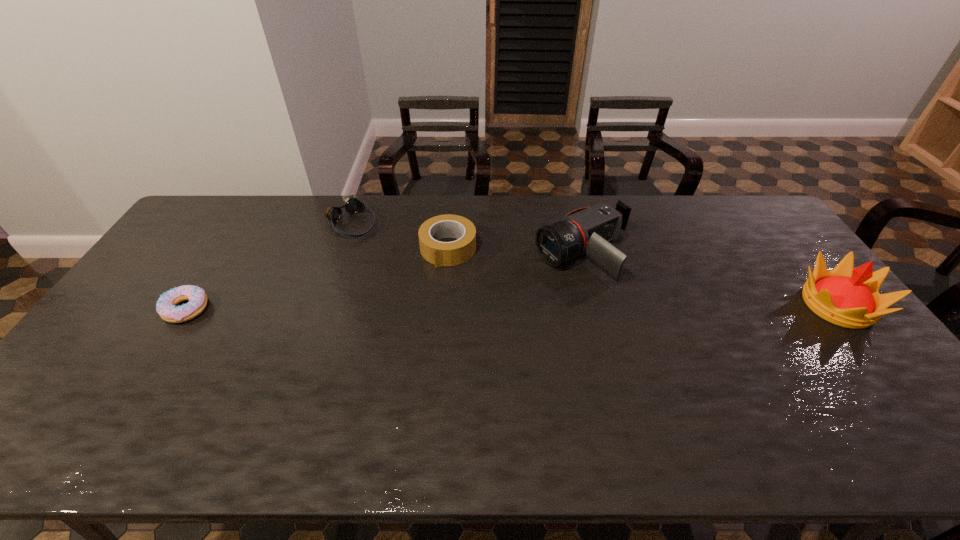
This screenshot has height=540, width=960. I want to click on free space between the crown and the duct tape, so click(x=642, y=277).

The height and width of the screenshot is (540, 960). What are the coordinates of `vacant area between the crown and the fourth object from left to right` in the screenshot? It's located at (710, 279).

Find the location of a particular element. vacant area between the crown and the shortest object is located at coordinates (512, 307).

Image resolution: width=960 pixels, height=540 pixels. I want to click on vacant space that is in between the doughnut and the crown, so click(x=512, y=307).

You are a GUI agent. You are given a task and a screenshot of the screen. Output one action in this format:
    pyautogui.click(x=<x>, y=<y>)
    Task: Click on the unoccupied area between the tallest object and the goggles
    
    Given the screenshot: What is the action you would take?
    pyautogui.click(x=595, y=264)

Find the location of a particular element. free space that is in between the leftmost object and the duct tape is located at coordinates (317, 279).

This screenshot has height=540, width=960. In order to click on free point between the fourth object from left to right and the doughnut in this screenshot , I will do [385, 281].

This screenshot has height=540, width=960. What are the coordinates of `object that stands as the fourth closest to the camcorder` in the screenshot? It's located at (166, 307).

I want to click on object that can be found as the closest to the second object from left to right, so click(439, 253).

Find the location of a particular element. The height and width of the screenshot is (540, 960). free location that satisfies the following two spatial constraints: 1. on the back side of the second object from left to right; 2. on the left side of the shortest object is located at coordinates (242, 222).